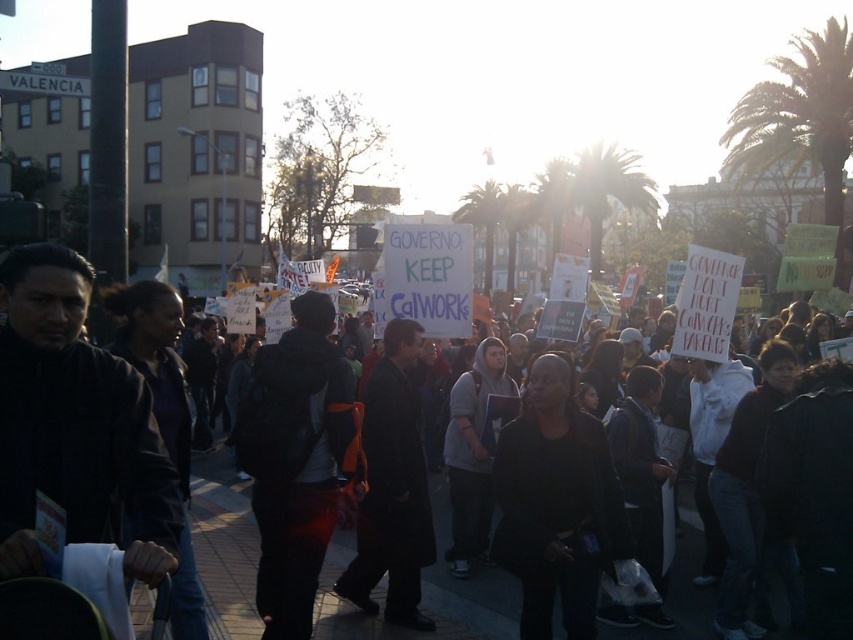
Question: Estimate the real-world distances between objects in this image. Which object is closer to the dark gray coat at center?

Choices:
 (A) dark gray jacket at center
 (B) green leafy palm tree at upper center
 (C) black matte jacket at center
 (D) green leafy palm tree at upper right

Answer: (A)

Question: Estimate the real-world distances between objects in this image. Which object is closer to the dark gray coat at center?

Choices:
 (A) green leafy palm tree at upper center
 (B) dark gray jacket at center
 (C) green leafy palm tree at upper right

Answer: (B)

Question: Is green leafy palm tree at upper right to the left of green leafy palm tree at upper center from the viewer's perspective?

Choices:
 (A) yes
 (B) no

Answer: (B)

Question: Which is nearer to the green leafy palm tree at upper right?

Choices:
 (A) green leafy palm tree at upper center
 (B) black matte jacket at center

Answer: (A)

Question: In this image, where is black matte jacket at center located relative to green leafy palm tree at upper right?

Choices:
 (A) below
 (B) above

Answer: (A)

Question: Can you confirm if dark gray jacket at center is thinner than green leafy palm tree at upper center?

Choices:
 (A) no
 (B) yes

Answer: (B)